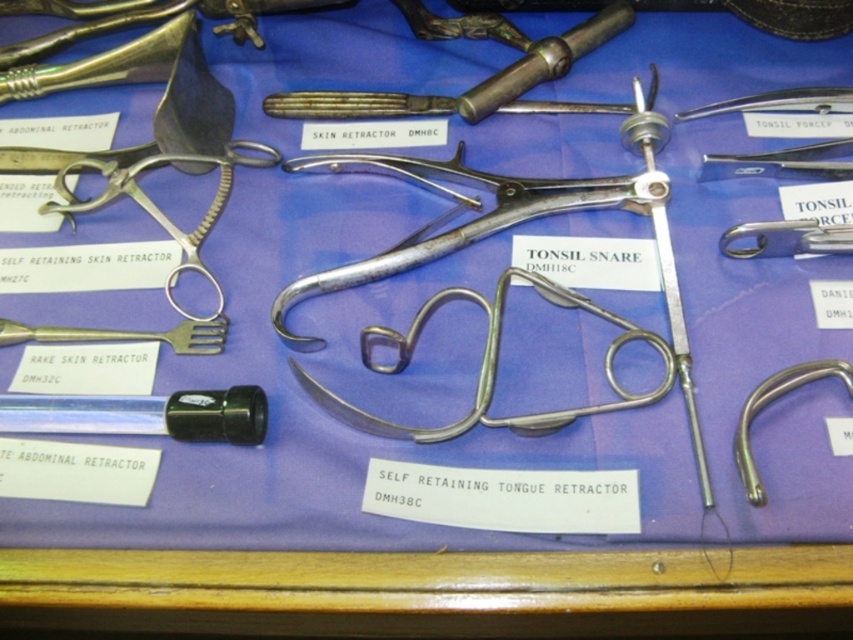
From the picture: Who is positioned more to the right, matte silver scissors at upper left or matte silver fork at left?

matte silver scissors at upper left is more to the right.

Is point (42, 209) more distant than point (193, 340)?

Yes, point (42, 209) is behind point (193, 340).

At what (x,y) coordinates should I click in order to perform the action: click on matte silver scissors at upper left. Please return your answer as a coordinate pair (x, y). Looking at the image, I should click on (158, 209).

The width and height of the screenshot is (853, 640). I want to click on black plastic tube at lower left, so click(x=144, y=413).

Between black plastic tube at lower left and matte silver fork at left, which one is positioned lower?

black plastic tube at lower left is lower down.

Is point (3, 429) positioned after point (212, 333)?

No, (3, 429) is in front of (212, 333).

At what (x,y) coordinates should I click in order to perform the action: click on black plastic tube at lower left. Please return your answer as a coordinate pair (x, y). The width and height of the screenshot is (853, 640). Looking at the image, I should click on (144, 413).

Looking at this image, which is below, metallic silver scissors at center or matte silver fork at left?

metallic silver scissors at center is below.

Who is shorter, metallic silver scissors at center or matte silver fork at left?

matte silver fork at left is shorter.

Is point (558, 300) farther from viewer compared to point (189, 340)?

No, it is not.

Locate an element on the screen. metallic silver scissors at center is located at coordinates (488, 365).